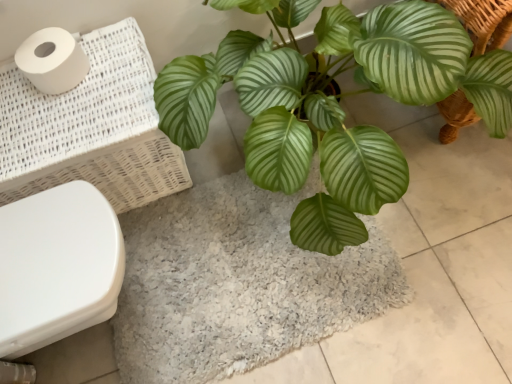
Question: Is gray shaggy bath mat at center at the back of white woven laundry basket at left?

Choices:
 (A) yes
 (B) no

Answer: (B)

Question: Is white woven laundry basket at left outside of gray shaggy bath mat at center?

Choices:
 (A) yes
 (B) no

Answer: (A)

Question: From a real-world perspective, is white woven laundry basket at left located beneath gray shaggy bath mat at center?

Choices:
 (A) no
 (B) yes

Answer: (A)

Question: Considering the relative sizes of white woven laundry basket at left and gray shaggy bath mat at center in the image provided, is white woven laundry basket at left thinner than gray shaggy bath mat at center?

Choices:
 (A) no
 (B) yes

Answer: (B)

Question: Does white woven laundry basket at left have a greater width compared to gray shaggy bath mat at center?

Choices:
 (A) no
 (B) yes

Answer: (A)

Question: Is white woven laundry basket at left surrounding gray shaggy bath mat at center?

Choices:
 (A) yes
 (B) no

Answer: (B)

Question: From the image's perspective, is green glossy leafy plant at center above white glossy toilet bowl at lower left?

Choices:
 (A) no
 (B) yes

Answer: (B)

Question: Is green glossy leafy plant at center looking in the opposite direction of white glossy toilet bowl at lower left?

Choices:
 (A) yes
 (B) no

Answer: (B)

Question: Considering the relative sizes of green glossy leafy plant at center and white glossy toilet bowl at lower left in the image provided, is green glossy leafy plant at center smaller than white glossy toilet bowl at lower left?

Choices:
 (A) yes
 (B) no

Answer: (B)

Question: Is green glossy leafy plant at center far from white glossy toilet bowl at lower left?

Choices:
 (A) yes
 (B) no

Answer: (B)

Question: Is green glossy leafy plant at center surrounding white glossy toilet bowl at lower left?

Choices:
 (A) no
 (B) yes

Answer: (A)

Question: Can you confirm if green glossy leafy plant at center is taller than white glossy toilet bowl at lower left?

Choices:
 (A) yes
 (B) no

Answer: (A)

Question: Can you confirm if white glossy toilet bowl at lower left is taller than white woven laundry basket at left?

Choices:
 (A) no
 (B) yes

Answer: (A)